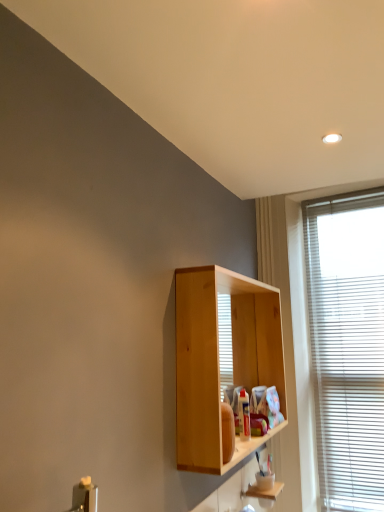
Question: From the image's perspective, is white blinds at right on top of natural wood cabinet at center?

Choices:
 (A) yes
 (B) no

Answer: (B)

Question: From a real-world perspective, is white blinds at right positioned over natural wood cabinet at center based on gravity?

Choices:
 (A) no
 (B) yes

Answer: (B)

Question: Considering the relative sizes of white blinds at right and natural wood cabinet at center in the image provided, is white blinds at right wider than natural wood cabinet at center?

Choices:
 (A) yes
 (B) no

Answer: (B)

Question: Considering the relative sizes of white blinds at right and natural wood cabinet at center in the image provided, is white blinds at right smaller than natural wood cabinet at center?

Choices:
 (A) yes
 (B) no

Answer: (A)

Question: Considering the relative positions of white blinds at right and natural wood cabinet at center in the image provided, is white blinds at right to the right of natural wood cabinet at center from the viewer's perspective?

Choices:
 (A) yes
 (B) no

Answer: (A)

Question: Does white blinds at right have a lesser height compared to natural wood cabinet at center?

Choices:
 (A) yes
 (B) no

Answer: (B)

Question: Is wooden cabinet at lower right behind natural wood cabinet at center?

Choices:
 (A) no
 (B) yes

Answer: (B)

Question: From the image's perspective, does wooden cabinet at lower right appear higher than natural wood cabinet at center?

Choices:
 (A) no
 (B) yes

Answer: (A)

Question: Is wooden cabinet at lower right bigger than natural wood cabinet at center?

Choices:
 (A) no
 (B) yes

Answer: (A)

Question: Does wooden cabinet at lower right have a greater height compared to natural wood cabinet at center?

Choices:
 (A) yes
 (B) no

Answer: (B)

Question: Is wooden cabinet at lower right shorter than natural wood cabinet at center?

Choices:
 (A) yes
 (B) no

Answer: (A)

Question: From a real-world perspective, is wooden cabinet at lower right on natural wood cabinet at center?

Choices:
 (A) yes
 (B) no

Answer: (B)

Question: Can you confirm if wooden shelf at lower center is bigger than wooden cabinet at lower right?

Choices:
 (A) no
 (B) yes

Answer: (A)